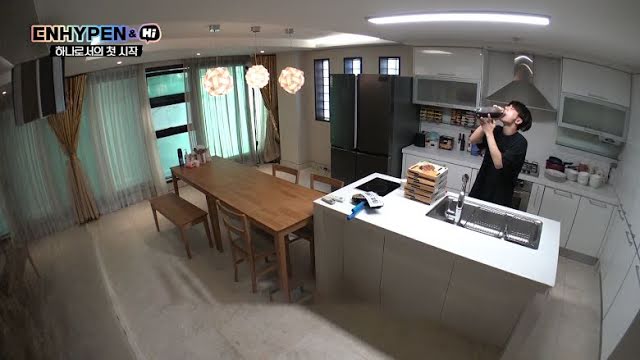
Where is `chairs`? The height and width of the screenshot is (360, 640). chairs is located at coordinates click(246, 243), click(283, 169), click(320, 179).